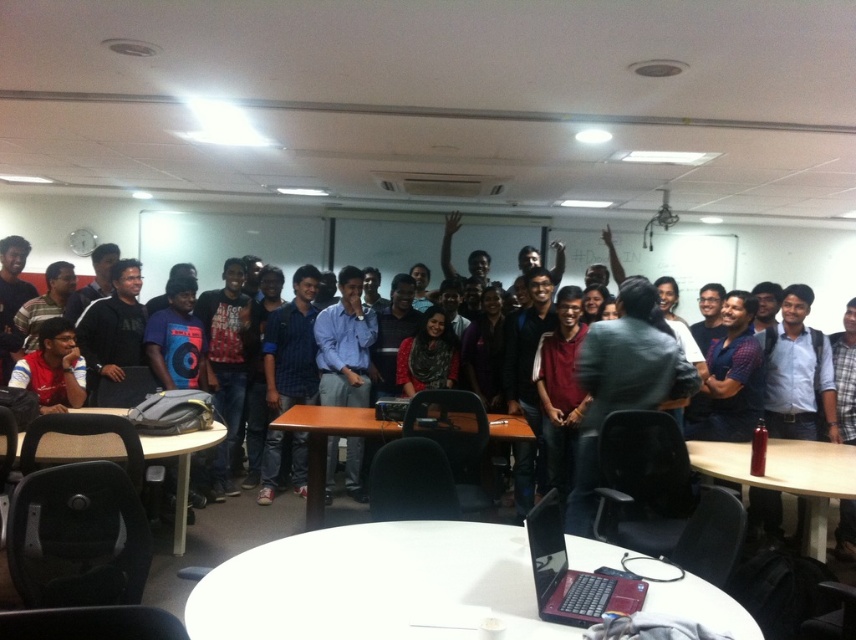
Question: Is white glossy table at center below light brown wooden table at lower left?

Choices:
 (A) yes
 (B) no

Answer: (A)

Question: Is light brown wooden table at lower left to the right of brown wooden table at center from the viewer's perspective?

Choices:
 (A) no
 (B) yes

Answer: (A)

Question: Estimate the real-world distances between objects in this image. Which object is farther from the red matte laptop at lower center?

Choices:
 (A) light brown wooden table at lower left
 (B) brown wooden table at center

Answer: (A)

Question: Is matte black laptop at center below brown wooden table at center?

Choices:
 (A) no
 (B) yes

Answer: (A)

Question: Which point is farther to the camera?

Choices:
 (A) (328, 579)
 (B) (806, 452)
 (C) (128, 250)
 (D) (52, 326)

Answer: (C)

Question: Which object is positioned closest to the light brown wooden table at lower left?

Choices:
 (A) brown wooden table at center
 (B) metallic silver table at lower right
 (C) matte red shirt at lower left

Answer: (C)